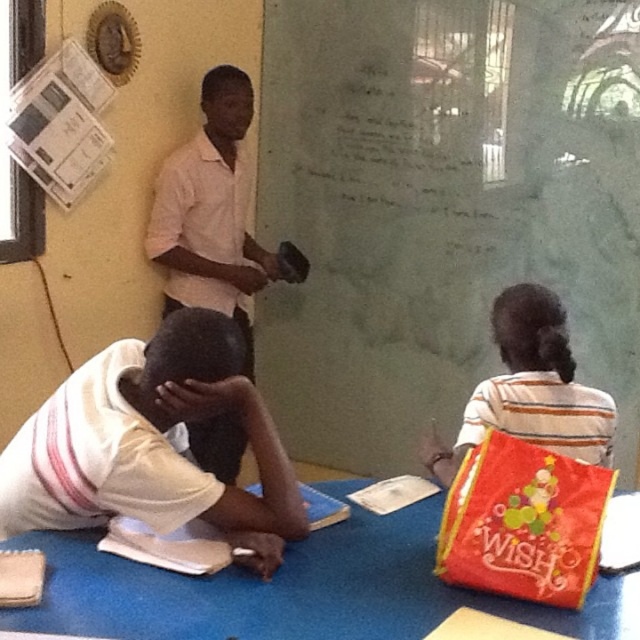
Which of these two, green matte chalkboard at center or white shirt at upper center, stands taller?

green matte chalkboard at center

From the picture: Who is positioned more to the right, green matte chalkboard at center or white shirt at upper center?

From the viewer's perspective, green matte chalkboard at center appears more on the right side.

Which is behind, point (307, 376) or point (230, 460)?

Positioned behind is point (307, 376).

I want to click on green matte chalkboard at center, so click(442, 205).

Is point (433, 380) farther from viewer compared to point (332, 490)?

That is True.

Who is more distant from viewer, [429,308] or [376,625]?

Point [429,308]

Locate an element on the screen. The width and height of the screenshot is (640, 640). green matte chalkboard at center is located at coordinates (442, 205).

Find the location of a particular element. The image size is (640, 640). green matte chalkboard at center is located at coordinates (442, 205).

What do you see at coordinates (442, 205) in the screenshot? I see `green matte chalkboard at center` at bounding box center [442, 205].

Identify the location of green matte chalkboard at center. (442, 205).